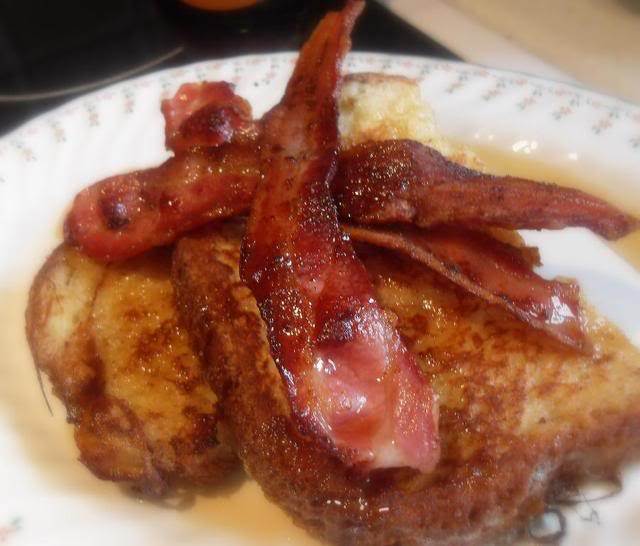
The image size is (640, 546). Identify the location of plate. (566, 138).